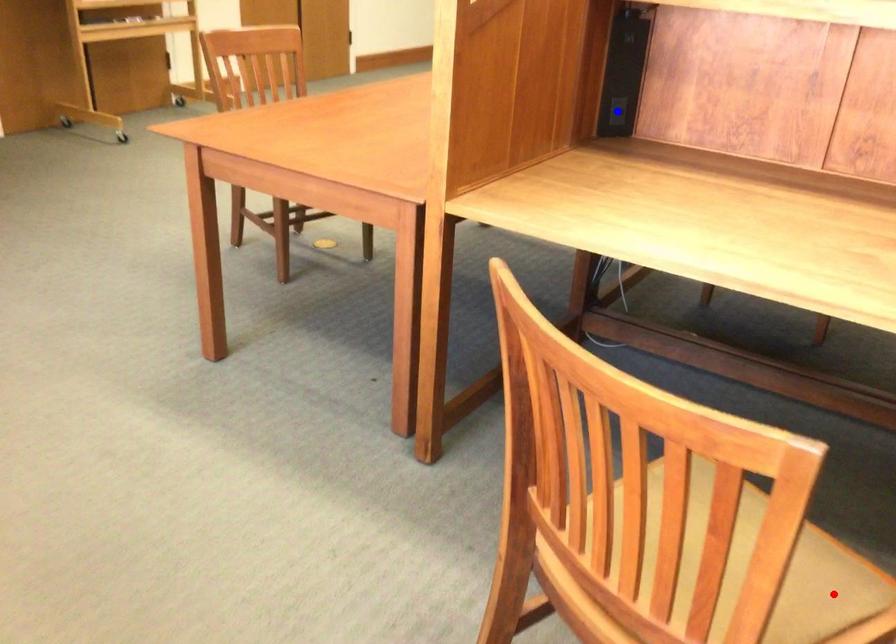
Question: Which of the two points in the image is closer to the camera?

Choices:
 (A) Blue point is closer.
 (B) Red point is closer.

Answer: (B)